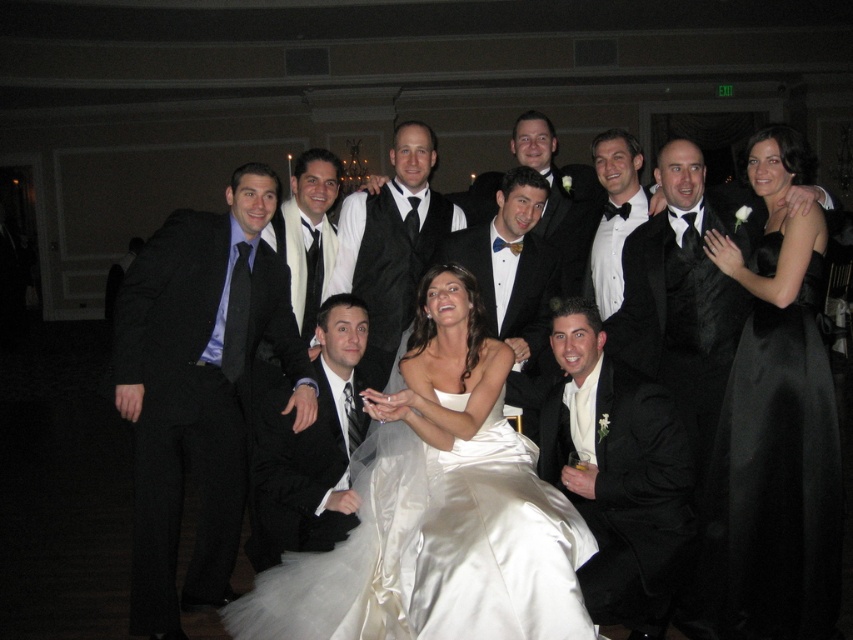
You are a photographer at a wedding reception. You want to take a closeup shot of the matte black tuxedo at center and the black satin bow tie at center. Which one should you focus on first to ensure both are in sharp focus?

The matte black tuxedo at center is further to the viewer than the black satin bow tie at center, so you should focus on the matte black tuxedo at center first to ensure both are in sharp focus.